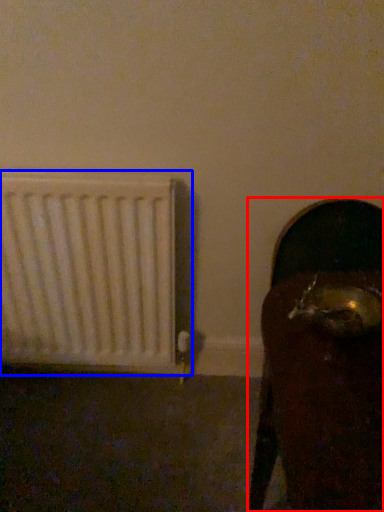
Question: Which object is closer to the camera taking this photo, furniture (highlighted by a red box) or radiator (highlighted by a blue box)?

Choices:
 (A) furniture
 (B) radiator

Answer: (A)